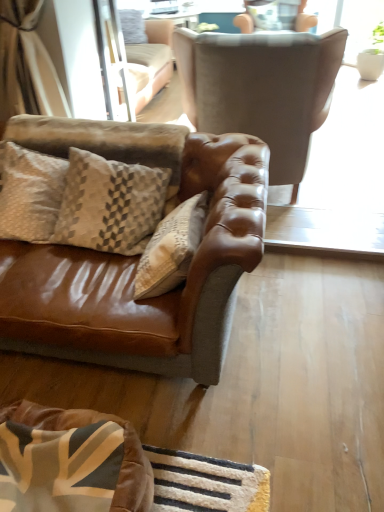
Question: Is suede-like beige armchair at upper center, positioned as the 1th chair in top-to-bottom order, at the back of beige textured pillow at left?

Choices:
 (A) no
 (B) yes

Answer: (B)

Question: From a real-world perspective, is beige textured pillow at left located higher than suede-like beige armchair at upper center, the second chair from the front?

Choices:
 (A) no
 (B) yes

Answer: (A)

Question: Can you confirm if beige textured pillow at left is thinner than suede-like beige armchair at upper center, acting as the 2th chair starting from the bottom?

Choices:
 (A) no
 (B) yes

Answer: (B)

Question: Is beige textured pillow at left bigger than suede-like beige armchair at upper center, positioned as the 1th chair in top-to-bottom order?

Choices:
 (A) yes
 (B) no

Answer: (B)

Question: From the image's perspective, is beige textured pillow at left located above suede-like beige armchair at upper center, the 1th chair when ordered from back to front?

Choices:
 (A) no
 (B) yes

Answer: (A)

Question: Considering the positions of beige textured pillow at left and suede-like beige armchair at upper center, positioned as the 1th chair in top-to-bottom order, in the image, is beige textured pillow at left wider or thinner than suede-like beige armchair at upper center, positioned as the 1th chair in top-to-bottom order,?

Choices:
 (A) thin
 (B) wide

Answer: (A)

Question: Is beige textured pillow at left to the left or to the right of suede-like beige armchair at upper center, the 1th chair when ordered from back to front, in the image?

Choices:
 (A) left
 (B) right

Answer: (A)

Question: From a real-world perspective, relative to suede-like beige armchair at upper center, acting as the 2th chair starting from the bottom, is beige textured pillow at left vertically above or below?

Choices:
 (A) below
 (B) above

Answer: (A)

Question: Is point (51, 216) closer or farther from the camera than point (268, 0)?

Choices:
 (A) farther
 (B) closer

Answer: (B)

Question: From a real-world perspective, relative to suede brown armchair at upper center, which appears as the second chair when viewed from the top, is suede-like beige armchair at upper center, acting as the 2th chair starting from the bottom, vertically above or below?

Choices:
 (A) above
 (B) below

Answer: (A)

Question: Is suede-like beige armchair at upper center, positioned as the 1th chair in top-to-bottom order, inside or outside of suede brown armchair at upper center, marked as the second chair in a back-to-front arrangement?

Choices:
 (A) outside
 (B) inside

Answer: (A)

Question: From the image's perspective, is suede-like beige armchair at upper center, the 1th chair when ordered from back to front, positioned above or below suede brown armchair at upper center, arranged as the 1th chair when viewed from the front?

Choices:
 (A) above
 (B) below

Answer: (A)

Question: Is suede-like beige armchair at upper center, acting as the 2th chair starting from the bottom, to the left or to the right of suede brown armchair at upper center, the 1th chair from the bottom, in the image?

Choices:
 (A) right
 (B) left

Answer: (A)

Question: Is suede brown armchair at upper center, which appears as the second chair when viewed from the top, to the left or to the right of suede-like beige armchair at upper center, positioned as the 1th chair in top-to-bottom order, in the image?

Choices:
 (A) left
 (B) right

Answer: (A)

Question: From the image's perspective, is suede brown armchair at upper center, which appears as the second chair when viewed from the top, positioned above or below suede-like beige armchair at upper center, the second chair from the front?

Choices:
 (A) below
 (B) above

Answer: (A)